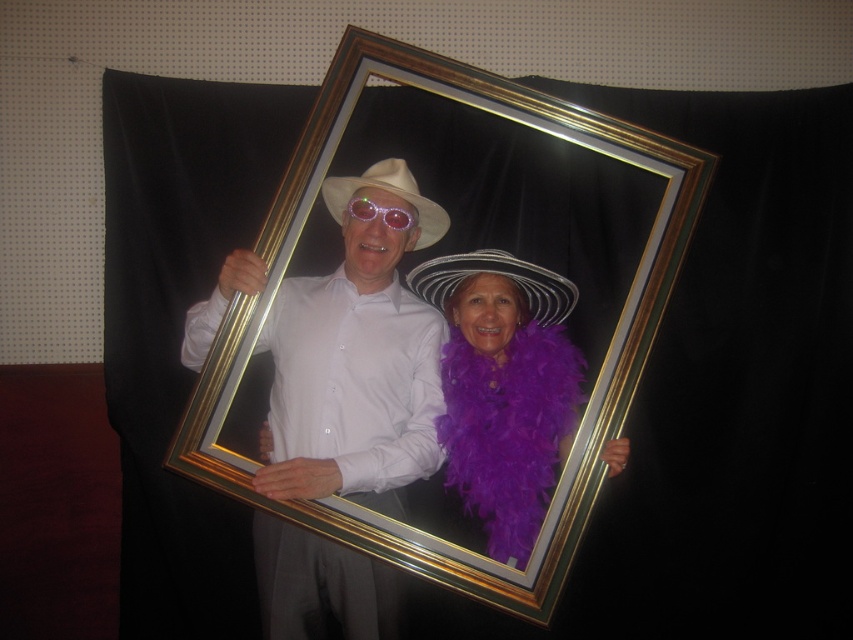
Who is higher up, gold metallic picture frame at center or black straw cowboy hat at center?

black straw cowboy hat at center

Between point (635, 339) and point (570, 289), which one is positioned in front?

Point (635, 339) is more forward.

The width and height of the screenshot is (853, 640). What are the coordinates of `gold metallic picture frame at center` in the screenshot? It's located at (560, 440).

Which is in front, point (425, 272) or point (430, 211)?

Point (425, 272) is in front.

Does black straw cowboy hat at center lie in front of white matte cowboy hat at center?

That is True.

Between point (555, 275) and point (347, 198), which one is positioned in front?

Point (555, 275)

Where is `black straw cowboy hat at center`? black straw cowboy hat at center is located at coordinates (497, 273).

Can you confirm if gold metallic picture frame at center is smaller than translucent plastic goggles at center?

No, gold metallic picture frame at center is not smaller than translucent plastic goggles at center.

Between gold metallic picture frame at center and translucent plastic goggles at center, which one has less height?

translucent plastic goggles at center is shorter.

Which is behind, point (329, 500) or point (346, 208)?

Positioned behind is point (346, 208).

Locate an element on the screen. The image size is (853, 640). gold metallic picture frame at center is located at coordinates (560, 440).